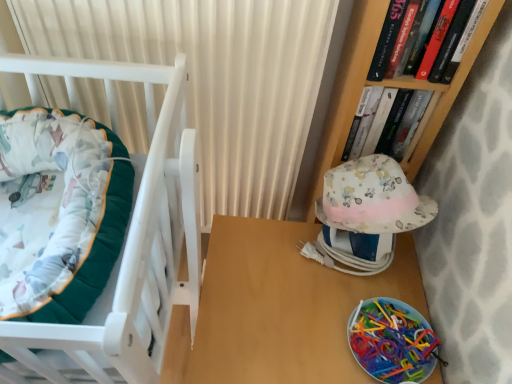
Question: From a real-world perspective, is hardcover book at upper right, the second book positioned from the front, located higher than hardcover book at upper right, which ranks as the second book in back-to-front order?

Choices:
 (A) yes
 (B) no

Answer: (B)

Question: Considering the relative sizes of hardcover book at upper right, the second book positioned from the front, and hardcover book at upper right, which appears as the first book when viewed from the front, in the image provided, is hardcover book at upper right, the second book positioned from the front, taller than hardcover book at upper right, which appears as the first book when viewed from the front,?

Choices:
 (A) no
 (B) yes

Answer: (A)

Question: Is hardcover book at upper right, marked as the first book in a back-to-front arrangement, oriented towards hardcover book at upper right, which ranks as the second book in back-to-front order?

Choices:
 (A) no
 (B) yes

Answer: (A)

Question: Is the position of hardcover book at upper right, marked as the first book in a back-to-front arrangement, less distant than that of hardcover book at upper right, which appears as the first book when viewed from the front?

Choices:
 (A) yes
 (B) no

Answer: (B)

Question: From the image's perspective, would you say hardcover book at upper right, marked as the first book in a back-to-front arrangement, is positioned over hardcover book at upper right, which appears as the first book when viewed from the front?

Choices:
 (A) yes
 (B) no

Answer: (B)

Question: From a real-world perspective, is hardcover book at upper right, the second book positioned from the front, positioned above or below hardcover book at upper right, which ranks as the second book in back-to-front order?

Choices:
 (A) below
 (B) above

Answer: (A)

Question: From the image's perspective, is hardcover book at upper right, marked as the first book in a back-to-front arrangement, located above or below hardcover book at upper right, which ranks as the second book in back-to-front order?

Choices:
 (A) above
 (B) below

Answer: (B)

Question: Considering the positions of hardcover book at upper right, marked as the first book in a back-to-front arrangement, and hardcover book at upper right, which ranks as the second book in back-to-front order, in the image, is hardcover book at upper right, marked as the first book in a back-to-front arrangement, wider or thinner than hardcover book at upper right, which ranks as the second book in back-to-front order,?

Choices:
 (A) thin
 (B) wide

Answer: (B)

Question: Is hardcover book at upper right, the second book positioned from the front, to the left or to the right of hardcover book at upper right, which ranks as the second book in back-to-front order, in the image?

Choices:
 (A) left
 (B) right

Answer: (A)

Question: Considering the positions of fluffy cotton hat at right and hardcover book at upper right, which appears as the first book when viewed from the front, in the image, is fluffy cotton hat at right wider or thinner than hardcover book at upper right, which appears as the first book when viewed from the front,?

Choices:
 (A) thin
 (B) wide

Answer: (B)

Question: From a real-world perspective, is fluffy cotton hat at right above or below hardcover book at upper right, which appears as the first book when viewed from the front?

Choices:
 (A) above
 (B) below

Answer: (B)

Question: From the image's perspective, is fluffy cotton hat at right located above or below hardcover book at upper right, which ranks as the second book in back-to-front order?

Choices:
 (A) below
 (B) above

Answer: (A)

Question: Is point (315, 210) closer or farther from the camera than point (442, 79)?

Choices:
 (A) farther
 (B) closer

Answer: (A)

Question: Is hardcover book at upper right, which appears as the first book when viewed from the front, wider or thinner than wooden table at center?

Choices:
 (A) wide
 (B) thin

Answer: (B)

Question: Would you say hardcover book at upper right, which appears as the first book when viewed from the front, is inside or outside wooden table at center?

Choices:
 (A) inside
 (B) outside

Answer: (B)